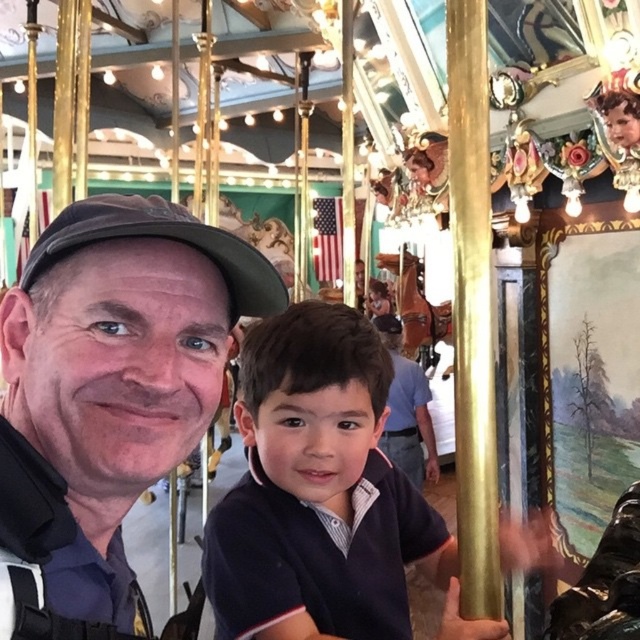
You are standing in the carousel and want to take a photo of both the matte black cap at left and the dark blue shirt at center. Since you can only focus on one object at a time, which one should you aim your camera at first to ensure both are in the frame?

You should aim your camera at the matte black cap at left first because it is to the left of the dark blue shirt at center, so capturing it first ensures the dark blue shirt at center will also be in the frame as you adjust.

You are standing in front of the carousel and want to reach a specific point marked at coordinates point (109,497). If your arm can extend 30 inches, can you comfortably reach that point without moving your position?

The distance of point (109,497) from viewer is 32.03 inches, so your arm cannot reach it since it is 2.03 inches too far.

You are a photographer positioned at the front of the carousel. You need to capture a photo of both the matte black cap at left and the dark blue shirt at center. Which object should you focus on first if you want to ensure both are in the frame without adjusting your camera angle?

You should focus on the dark blue shirt at center first because the matte black cap at left is not as tall as the dark blue shirt at center, so positioning the camera to include the taller object first ensures both will be in frame.